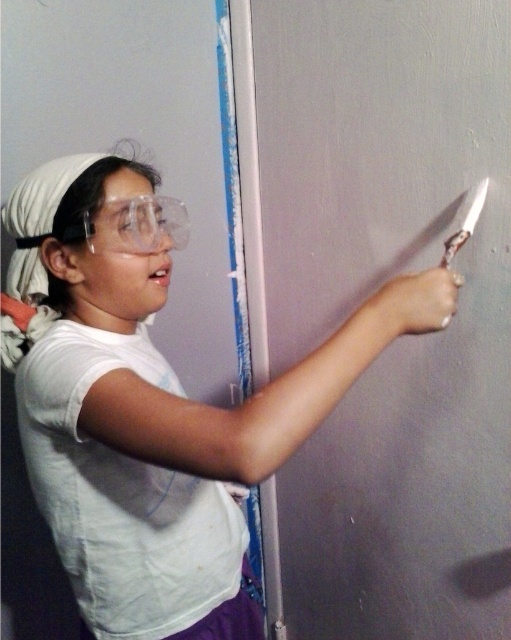
Question: Does white matte t-shirt at center have a lesser width compared to metallic silver knife at upper right?

Choices:
 (A) no
 (B) yes

Answer: (A)

Question: Which point is farther from the camera taking this photo?

Choices:
 (A) (109, 525)
 (B) (473, 202)

Answer: (B)

Question: Which object is farther from the camera taking this photo?

Choices:
 (A) metallic silver knife at upper right
 (B) white matte t-shirt at center

Answer: (A)

Question: Is white matte t-shirt at center positioned behind metallic silver knife at upper right?

Choices:
 (A) yes
 (B) no

Answer: (B)

Question: Can you confirm if white matte t-shirt at center is positioned to the left of metallic silver knife at upper right?

Choices:
 (A) no
 (B) yes

Answer: (B)

Question: Which of the following is the farthest from the observer?

Choices:
 (A) [32, 410]
 (B) [473, 195]

Answer: (B)